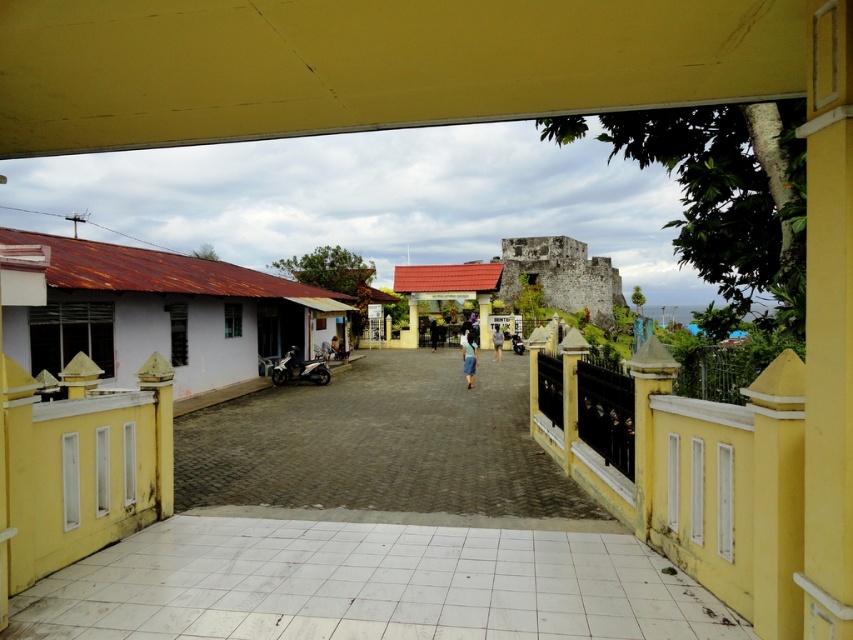
Question: Does yellow matte pillar at right appear on the right side of yellow painted stone pillar at right?

Choices:
 (A) yes
 (B) no

Answer: (A)

Question: Which of these objects is positioned farthest from the yellow matte pillar at center?

Choices:
 (A) blue fabric person at center
 (B) metallic silver motorcycle at center
 (C) brown cobblestone alley at center
 (D) yellow painted wood post at center

Answer: (C)

Question: Can you confirm if white tile path at center is positioned to the right of light blue denim skirt at center?

Choices:
 (A) no
 (B) yes

Answer: (A)

Question: Which of the following is the closest to the observer?

Choices:
 (A) (465, 346)
 (B) (498, 352)

Answer: (A)

Question: Can you confirm if yellow painted stone pillar at right is positioned below blue fabric shirt at center?

Choices:
 (A) yes
 (B) no

Answer: (A)

Question: Estimate the real-world distances between objects in this image. Which object is closer to the yellow matte pillar at right?

Choices:
 (A) yellow painted stone pillar at right
 (B) white tile path at center

Answer: (A)